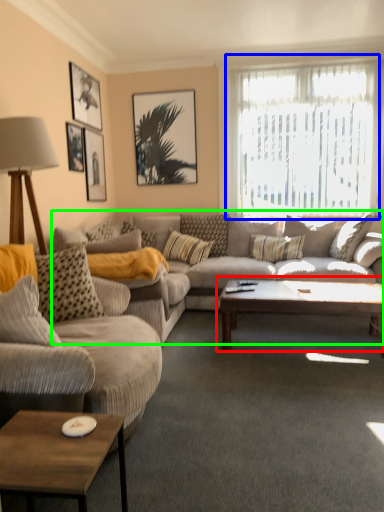
Question: Estimate the real-world distances between objects in this image. Which object is farther from coffee table (highlighted by a red box), window (highlighted by a blue box) or studio couch (highlighted by a green box)?

Choices:
 (A) window
 (B) studio couch

Answer: (A)